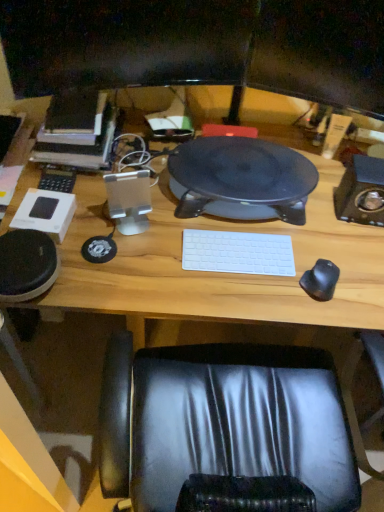
Where is `vacant area located to the right-hand side of black rubber mouse at right`? vacant area located to the right-hand side of black rubber mouse at right is located at coordinates (359, 287).